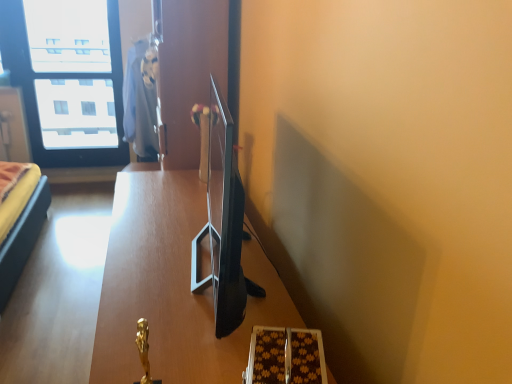
What is the approximate height of wooden table at center?

33.70 inches.

Describe the element at coordinates (141, 101) in the screenshot. The height and width of the screenshot is (384, 512). I see `matte blue robe at upper center` at that location.

Image resolution: width=512 pixels, height=384 pixels. I want to click on transparent glass window at upper left, so click(x=67, y=78).

From the image's perspective, is transparent glass window at upper left positioned above or below matte blue robe at upper center?

transparent glass window at upper left is above matte blue robe at upper center.

Does transparent glass window at upper left turn towards matte blue robe at upper center?

No, transparent glass window at upper left does not turn towards matte blue robe at upper center.

Is transparent glass window at upper left closer to camera compared to matte blue robe at upper center?

No, it is behind matte blue robe at upper center.

Does transparent glass window at upper left have a lesser height compared to matte blue robe at upper center?

Incorrect, the height of transparent glass window at upper left does not fall short of that of matte blue robe at upper center.

Is matte blue robe at upper center smaller than wooden table at center?

Yes, matte blue robe at upper center is smaller than wooden table at center.

Is matte blue robe at upper center situated inside wooden table at center or outside?

matte blue robe at upper center is outside wooden table at center.

Considering the relative sizes of matte blue robe at upper center and wooden table at center in the image provided, is matte blue robe at upper center wider than wooden table at center?

No.

Where is `table that appears in front of the matte blue robe at upper center`? This screenshot has height=384, width=512. table that appears in front of the matte blue robe at upper center is located at coordinates (172, 287).

Which is correct: wooden table at center is inside matte blue robe at upper center, or outside of it?

The correct answer is: outside.

Looking at this image, can you tell me how much wooden table at center and matte blue robe at upper center differ in facing direction?

0.673 degrees.

The width and height of the screenshot is (512, 384). In order to click on robe behind the wooden table at center in this screenshot , I will do `click(141, 101)`.

From the picture: Which is nearer, (179, 365) or (152, 112)?

Point (179, 365) is positioned closer to the camera compared to point (152, 112).

Is wooden table at center in front of transparent glass window at upper left?

Yes, it is in front of transparent glass window at upper left.

Which point is more distant from viewer, (138, 185) or (94, 144)?

The point (94, 144) is more distant.

From the image's perspective, is wooden table at center beneath transparent glass window at upper left?

Yes, from the image's perspective, wooden table at center is below transparent glass window at upper left.

Is wooden table at center directly adjacent to transparent glass window at upper left?

No, wooden table at center is not in contact with transparent glass window at upper left.

Between transparent glass window at upper left and wooden table at center, which one has more height?

transparent glass window at upper left is taller.

How many degrees apart are the facing directions of transparent glass window at upper left and wooden table at center?

89.5 degrees.

Is transparent glass window at upper left oriented away from wooden table at center?

No, transparent glass window at upper left is not facing away from wooden table at center.

From the image's perspective, is matte blue robe at upper center below transparent glass window at upper left?

Yes, from the image's perspective, matte blue robe at upper center is beneath transparent glass window at upper left.

Is matte blue robe at upper center further to camera compared to transparent glass window at upper left?

No, matte blue robe at upper center is in front of transparent glass window at upper left.

Which is farther, (123, 119) or (42, 94)?

Positioned behind is point (42, 94).

You are a GUI agent. You are given a task and a screenshot of the screen. Output one action in this format:
    pyautogui.click(x=<x>, y=<y>)
    Task: Click on the robe that is in front of the transparent glass window at upper left
    The image size is (512, 384).
    Given the screenshot: What is the action you would take?
    pyautogui.click(x=141, y=101)

There is a wooden table at center. Identify the location of robe above it (from a real-world perspective). (141, 101).

Estimate the real-world distances between objects in this image. Which object is further from matte blue robe at upper center, transparent glass window at upper left or wooden table at center?

The object further to matte blue robe at upper center is wooden table at center.

In the scene shown: Which object lies further to the anchor point transparent glass window at upper left, matte blue robe at upper center or wooden table at center?

Based on the image, wooden table at center appears to be further to transparent glass window at upper left.

When comparing their distances from wooden table at center, does transparent glass window at upper left or matte blue robe at upper center seem closer?

The object closer to wooden table at center is matte blue robe at upper center.

Looking at the image, which one is located further to matte blue robe at upper center, wooden table at center or transparent glass window at upper left?

wooden table at center is further to matte blue robe at upper center.

Looking at this image, looking at the image, which one is located further to wooden table at center, matte blue robe at upper center or transparent glass window at upper left?

transparent glass window at upper left lies further to wooden table at center than the other object.

Estimate the real-world distances between objects in this image. Which object is further from transparent glass window at upper left, wooden table at center or matte blue robe at upper center?

Based on the image, wooden table at center appears to be further to transparent glass window at upper left.

You are a GUI agent. You are given a task and a screenshot of the screen. Output one action in this format:
    pyautogui.click(x=<x>, y=<y>)
    Task: Click on the robe between wooden table at center and transparent glass window at upper left along the z-axis
    This screenshot has width=512, height=384.
    Given the screenshot: What is the action you would take?
    [141, 101]